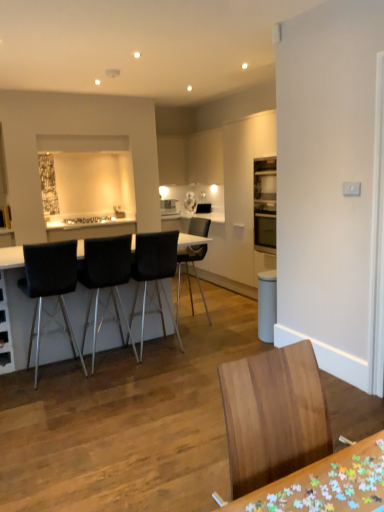
You are a GUI agent. You are given a task and a screenshot of the screen. Output one action in this format:
    pyautogui.click(x=<x>, y=<y>)
    Task: Click on the free spot above wooden puzzle pieces at lower right, which ranks as the 1th table in front-to-back order (from a real-world perspective)
    The image size is (384, 512).
    Given the screenshot: What is the action you would take?
    pyautogui.click(x=332, y=485)